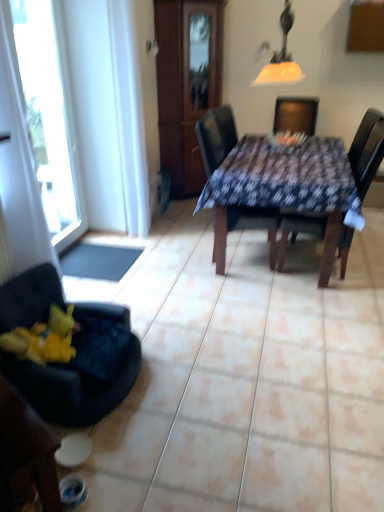
Where is `spots to the right of velvet black chair at lower left, the third chair positioned from the right`? Image resolution: width=384 pixels, height=512 pixels. spots to the right of velvet black chair at lower left, the third chair positioned from the right is located at coordinates (198, 401).